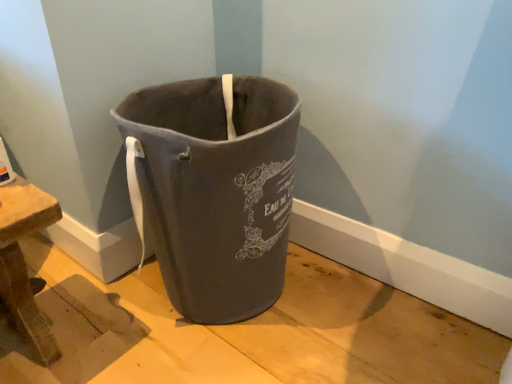
Image resolution: width=512 pixels, height=384 pixels. Describe the element at coordinates (216, 189) in the screenshot. I see `matte gray fabric bucket at center` at that location.

Image resolution: width=512 pixels, height=384 pixels. I want to click on matte gray fabric bucket at center, so click(216, 189).

Find the location of a particular element. matte gray fabric bucket at center is located at coordinates (216, 189).